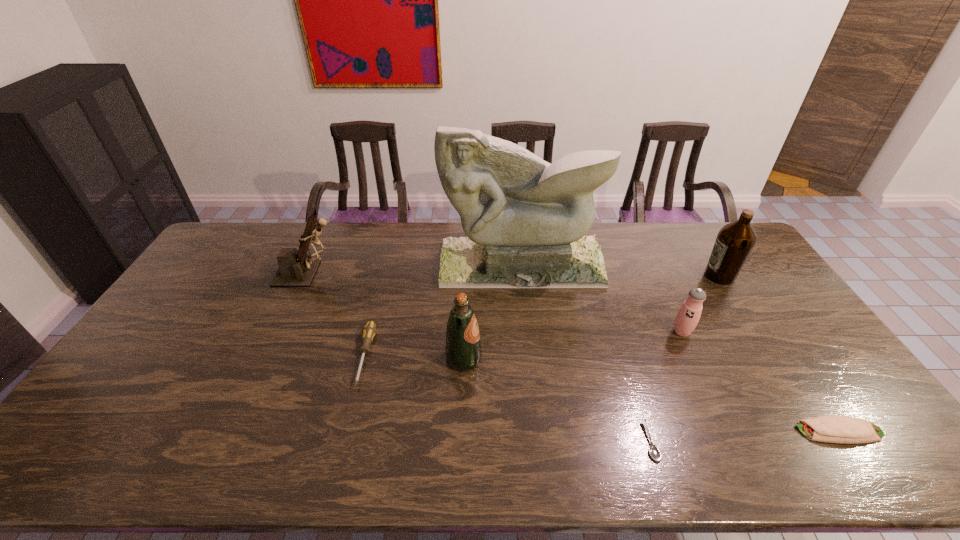
This screenshot has height=540, width=960. I want to click on the tallest object, so click(525, 219).

Locate an element on the screen. The width and height of the screenshot is (960, 540). the leftmost object is located at coordinates (296, 268).

You are a GUI agent. You are given a task and a screenshot of the screen. Output one action in this format:
    pyautogui.click(x=<x>, y=<y>)
    Task: Click on the farther olive oil
    Image resolution: width=960 pixels, height=540 pixels.
    Given the screenshot: What is the action you would take?
    pyautogui.click(x=735, y=240)

Where is `the nearer olive oil`? This screenshot has width=960, height=540. the nearer olive oil is located at coordinates click(x=463, y=351).

The image size is (960, 540). Identify the location of the fourth shortest object. (688, 316).

Where is `the sixth object from left to right`? The image size is (960, 540). the sixth object from left to right is located at coordinates (688, 316).

The width and height of the screenshot is (960, 540). What are the coordinates of `screwdriver` in the screenshot? It's located at (369, 331).

This screenshot has width=960, height=540. What are the coordinates of `the seventh object from right to left` in the screenshot? It's located at (369, 331).

The height and width of the screenshot is (540, 960). I want to click on burrito, so click(843, 429).

What are the coordinates of `the shortest object` in the screenshot? It's located at (654, 451).